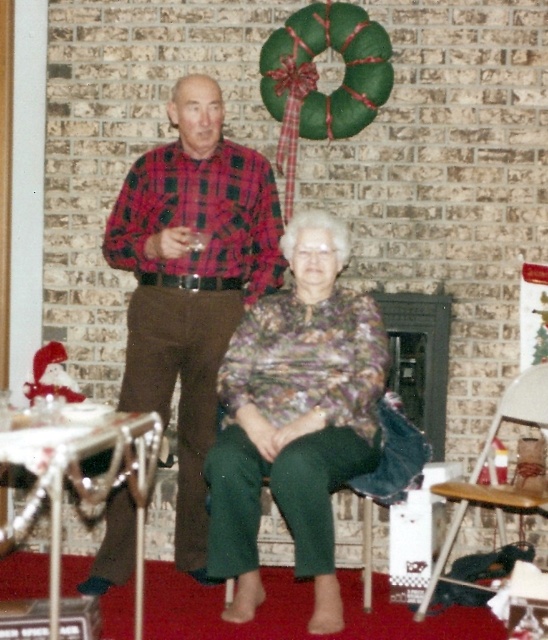
Question: From the image, what is the correct spatial relationship of printed fabric blouse at center in relation to wooden folding chair at lower right?

Choices:
 (A) below
 (B) above

Answer: (B)

Question: Observing the image, what is the correct spatial positioning of printed fabric blouse at center in reference to wooden folding chair at lower right?

Choices:
 (A) left
 (B) right

Answer: (A)

Question: Can you confirm if plaid fabric shirt at center is positioned to the left of wooden folding chair at lower right?

Choices:
 (A) yes
 (B) no

Answer: (A)

Question: Which of the following is the closest to the observer?

Choices:
 (A) (473, 483)
 (B) (298, 276)
 (C) (137, 262)

Answer: (A)

Question: Which point is farther to the camera?

Choices:
 (A) wooden folding chair at lower right
 (B) plaid fabric shirt at center

Answer: (B)

Question: Which of these objects is positioned farthest from the plaid fabric shirt at center?

Choices:
 (A) printed fabric blouse at center
 (B) wooden folding chair at lower right

Answer: (B)